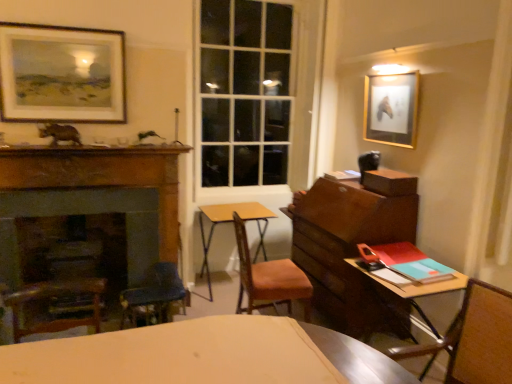
What is the approximate width of wooden desk at right, which is the first table in front-to-back order?

wooden desk at right, which is the first table in front-to-back order, is 61.66 centimeters wide.

You are a GUI agent. You are given a task and a screenshot of the screen. Output one action in this format:
    pyautogui.click(x=<x>, y=<y>)
    Task: Click on the wooden chair at right, which is counted as the second chair, starting from the back
    The width and height of the screenshot is (512, 384).
    Given the screenshot: What is the action you would take?
    pyautogui.click(x=474, y=338)

What do you see at coordinates (474, 338) in the screenshot? I see `wooden chair at right, arranged as the first chair when viewed from the right` at bounding box center [474, 338].

This screenshot has width=512, height=384. Describe the element at coordinates (269, 279) in the screenshot. I see `wooden chair at center, which is counted as the second chair, starting from the right` at that location.

This screenshot has height=384, width=512. I want to click on wooden desk at right, which is the first table in front-to-back order, so click(415, 284).

Can you tell me how much teal matte book at right and matte black picture frame at upper left, marked as the 2th picture frame in a right-to-left arrangement, differ in facing direction?

There is a 88.1-degree angle between the facing directions of teal matte book at right and matte black picture frame at upper left, marked as the 2th picture frame in a right-to-left arrangement.

Is teal matte book at right located outside matte black picture frame at upper left, which is the 1th picture frame from left to right?

Yes, teal matte book at right is located beyond the bounds of matte black picture frame at upper left, which is the 1th picture frame from left to right.

Does teal matte book at right have a smaller size compared to matte black picture frame at upper left, marked as the 2th picture frame in a right-to-left arrangement?

Yes.

Can you confirm if teal matte book at right is thinner than matte black picture frame at upper left, marked as the 2th picture frame in a right-to-left arrangement?

No.

Who is shorter, gold-framed picture at upper right, arranged as the first picture frame when viewed from the right, or wooden desk at right, which is the first table in front-to-back order?

With less height is gold-framed picture at upper right, arranged as the first picture frame when viewed from the right.

Considering the sizes of objects gold-framed picture at upper right, arranged as the first picture frame when viewed from the right, and wooden desk at right, which is the first table in front-to-back order, in the image provided, who is smaller, gold-framed picture at upper right, arranged as the first picture frame when viewed from the right, or wooden desk at right, which is the first table in front-to-back order,?

gold-framed picture at upper right, arranged as the first picture frame when viewed from the right, is smaller.

The image size is (512, 384). I want to click on picture frame that is the 1st one above the wooden desk at right, which is the 2th table from back to front (from a real-world perspective), so click(x=391, y=109).

Is gold-framed picture at upper right, the second picture frame positioned from the left, facing towards wooden desk at right, which ranks as the second table in left-to-right order?

No.

Is yellow wood table at center, the first table from the left, a part of wooden chair at right, arranged as the first chair when viewed from the right?

That's incorrect, yellow wood table at center, the first table from the left, is not inside wooden chair at right, arranged as the first chair when viewed from the right.

Which chair is the 2nd one when counting from the right side of the yellow wood table at center, the 2th table from the front? Please provide its 2D coordinates.

[(474, 338)]

Is wooden chair at right, which is counted as the second chair, starting from the back, taller than yellow wood table at center, the 2th table from the front?

Incorrect, the height of wooden chair at right, which is counted as the second chair, starting from the back, is not larger of that of yellow wood table at center, the 2th table from the front.

Who is taller, matte black picture frame at upper left, marked as the 2th picture frame in a right-to-left arrangement, or wooden chair at center, which is counted as the second chair, starting from the right?

With more height is wooden chair at center, which is counted as the second chair, starting from the right.

Visually, is matte black picture frame at upper left, marked as the 2th picture frame in a right-to-left arrangement, positioned to the left or to the right of wooden chair at center, which is the 2th chair in front-to-back order?

Clearly, matte black picture frame at upper left, marked as the 2th picture frame in a right-to-left arrangement, is on the left of wooden chair at center, which is the 2th chair in front-to-back order, in the image.

From a real-world perspective, who is located higher, matte black picture frame at upper left, which is the 1th picture frame from left to right, or wooden chair at center, which is the 2th chair in front-to-back order?

In real-world perspective, matte black picture frame at upper left, which is the 1th picture frame from left to right, is above.

Is matte black picture frame at upper left, which is the 1th picture frame from left to right, positioned beyond the bounds of yellow wood table at center, the first table from the left?

Yes, matte black picture frame at upper left, which is the 1th picture frame from left to right, is not within yellow wood table at center, the first table from the left.

In the scene shown: Can you tell me how much matte black picture frame at upper left, marked as the 2th picture frame in a right-to-left arrangement, and yellow wood table at center, the 1th table positioned from the back, differ in facing direction?

1.15 degrees.

Does matte black picture frame at upper left, which is the 1th picture frame from left to right, turn towards yellow wood table at center, the 2th table from the front?

No, matte black picture frame at upper left, which is the 1th picture frame from left to right, is not turned towards yellow wood table at center, the 2th table from the front.

Is matte black picture frame at upper left, which is the 1th picture frame from left to right, taller or shorter than yellow wood table at center, the first table from the left?

matte black picture frame at upper left, which is the 1th picture frame from left to right, is shorter than yellow wood table at center, the first table from the left.

Could you measure the distance between wooden fireplace at left and matte black picture frame at upper left, marked as the 2th picture frame in a right-to-left arrangement?

The distance of wooden fireplace at left from matte black picture frame at upper left, marked as the 2th picture frame in a right-to-left arrangement, is 20.57 inches.

Image resolution: width=512 pixels, height=384 pixels. Find the location of `fireplace to the right of matte black picture frame at upper left, marked as the 2th picture frame in a right-to-left arrangement`. fireplace to the right of matte black picture frame at upper left, marked as the 2th picture frame in a right-to-left arrangement is located at coordinates (93, 205).

Can you confirm if wooden fireplace at left is wider than matte black picture frame at upper left, marked as the 2th picture frame in a right-to-left arrangement?

Incorrect, the width of wooden fireplace at left does not surpass that of matte black picture frame at upper left, marked as the 2th picture frame in a right-to-left arrangement.

Is wooden fireplace at left inside the boundaries of matte black picture frame at upper left, which is the 1th picture frame from left to right, or outside?

wooden fireplace at left is not inside matte black picture frame at upper left, which is the 1th picture frame from left to right, it's outside.

Can wooden desk at right, the first table positioned from the right, be found inside yellow wood table at center, the 2th table from the front?

No, wooden desk at right, the first table positioned from the right, is not inside yellow wood table at center, the 2th table from the front.

Are yellow wood table at center, which appears as the 2th table when viewed from the right, and wooden desk at right, which is the 2th table from back to front, beside each other?

No, yellow wood table at center, which appears as the 2th table when viewed from the right, is not making contact with wooden desk at right, which is the 2th table from back to front.

From the image's perspective, is yellow wood table at center, the 1th table positioned from the back, under wooden desk at right, which is the 2th table from back to front?

No.

Can you confirm if yellow wood table at center, which appears as the 2th table when viewed from the right, is positioned to the right of wooden desk at right, which is the first table in front-to-back order?

In fact, yellow wood table at center, which appears as the 2th table when viewed from the right, is to the left of wooden desk at right, which is the first table in front-to-back order.

In order to click on book in front of the matte black picture frame at upper left, marked as the 2th picture frame in a right-to-left arrangement in this screenshot , I will do `click(423, 271)`.

I want to click on the 1st picture frame above when counting from the wooden desk at right, which ranks as the second table in left-to-right order (from the image's perspective), so click(391, 109).

From the image, which object appears to be nearer to wooden chair at right, arranged as the 2th chair when viewed from the left, teal matte book at right or yellow wood table at center, the first table from the left?

teal matte book at right is positioned closer to the anchor wooden chair at right, arranged as the 2th chair when viewed from the left.

When comparing their distances from wooden fireplace at left, does gold-framed picture at upper right, the second picture frame positioned from the left, or yellow wood table at center, which appears as the 2th table when viewed from the right, seem closer?

yellow wood table at center, which appears as the 2th table when viewed from the right.

Which object lies further to the anchor point wooden fireplace at left, teal matte book at right or wooden chair at right, arranged as the 2th chair when viewed from the left?

The object further to wooden fireplace at left is wooden chair at right, arranged as the 2th chair when viewed from the left.

Looking at the image, which one is located further to matte black picture frame at upper left, which is the 1th picture frame from left to right, wooden fireplace at left or yellow wood table at center, which appears as the 2th table when viewed from the right?

yellow wood table at center, which appears as the 2th table when viewed from the right.

Estimate the real-world distances between objects in this image. Which object is further from wooden chair at center, the first chair positioned from the back, matte black picture frame at upper left, which is the 1th picture frame from left to right, or yellow wood table at center, the 1th table positioned from the back?

matte black picture frame at upper left, which is the 1th picture frame from left to right, lies further to wooden chair at center, the first chair positioned from the back, than the other object.

Considering their positions, is wooden chair at right, arranged as the first chair when viewed from the front, positioned closer to wooden fireplace at left than yellow wood table at center, the 1th table positioned from the back?

The object closer to wooden fireplace at left is yellow wood table at center, the 1th table positioned from the back.

Considering their positions, is wooden desk at right, which is the 2th table from back to front, positioned further to wooden fireplace at left than teal matte book at right?

teal matte book at right.

Looking at this image, estimate the real-world distances between objects in this image. Which object is further from matte black picture frame at upper left, which is the 1th picture frame from left to right, wooden chair at right, arranged as the first chair when viewed from the front, or teal matte book at right?

wooden chair at right, arranged as the first chair when viewed from the front, is positioned further to the anchor matte black picture frame at upper left, which is the 1th picture frame from left to right.

Identify the location of table located between wooden chair at right, arranged as the first chair when viewed from the front, and teal matte book at right in the depth direction. coord(415,284).

The image size is (512, 384). What are the coordinates of `fireplace between matte black picture frame at upper left, which is the 1th picture frame from left to right, and yellow wood table at center, the first table from the left, from top to bottom` in the screenshot? It's located at (93, 205).

Locate an element on the screen. The height and width of the screenshot is (384, 512). book between yellow wood table at center, the 1th table positioned from the back, and gold-framed picture at upper right, the second picture frame positioned from the left, in the horizontal direction is located at coordinates (423, 271).

You are a GUI agent. You are given a task and a screenshot of the screen. Output one action in this format:
    pyautogui.click(x=<x>, y=<y>)
    Task: Click on the chair situated between matte black picture frame at upper left, marked as the 2th picture frame in a right-to-left arrangement, and wooden chair at right, arranged as the first chair when viewed from the right, from left to right
    The height and width of the screenshot is (384, 512).
    Given the screenshot: What is the action you would take?
    pyautogui.click(x=269, y=279)